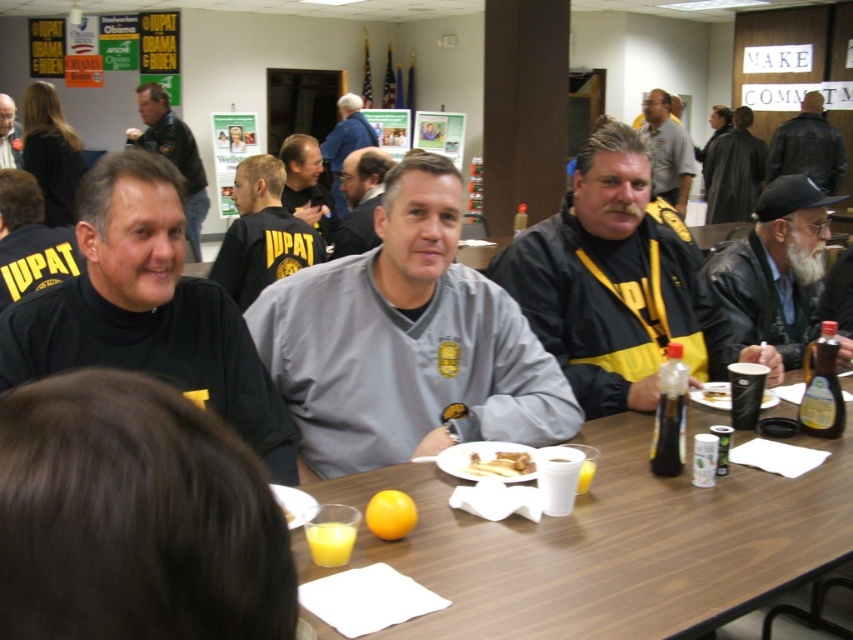
Question: Where is black turtleneck sweater at center located in relation to gray fleece sweatshirt at center in the image?

Choices:
 (A) below
 (B) above

Answer: (A)

Question: Where is black leather jacket at upper left located in relation to gray fleece sweatshirt at center in the image?

Choices:
 (A) above
 (B) below

Answer: (A)

Question: Is black leather jacket at upper right to the left of yellow lanyard at center from the viewer's perspective?

Choices:
 (A) yes
 (B) no

Answer: (B)

Question: Among these objects, which one is farthest from the camera?

Choices:
 (A) gray fleece jacket at center
 (B) black turtleneck sweater at center
 (C) black/yellow jacket at center
 (D) black uniform at left

Answer: (A)

Question: Which point is farther from the camera taking this photo?

Choices:
 (A) (350, 164)
 (B) (288, 173)

Answer: (B)

Question: Which of the following is the closest to the observer?

Choices:
 (A) gray fleece sweater at center
 (B) black/yellow jacket at center
 (C) black uniform at left
 (D) yellow matte french fries at center

Answer: (D)